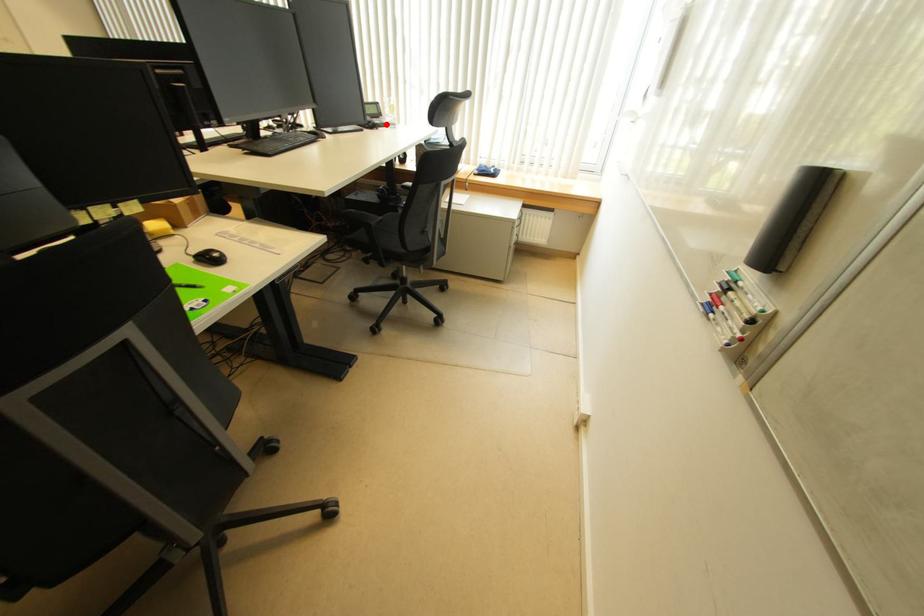
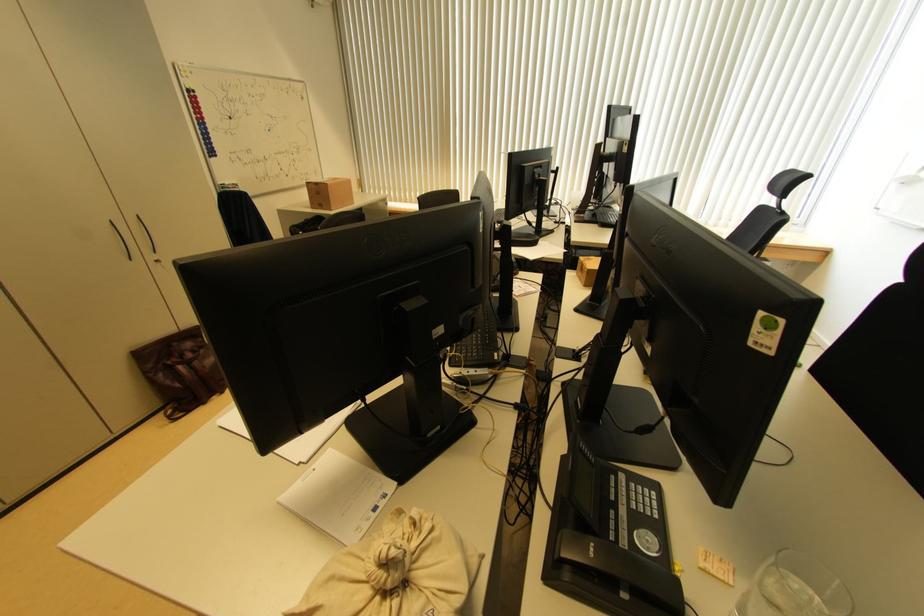
Question: I am providing you with two images of the same scene from different viewpoints. A red point is marked on the first image. Can you still see the location of the red point in image 2?

Choices:
 (A) Yes
 (B) No

Answer: (B)